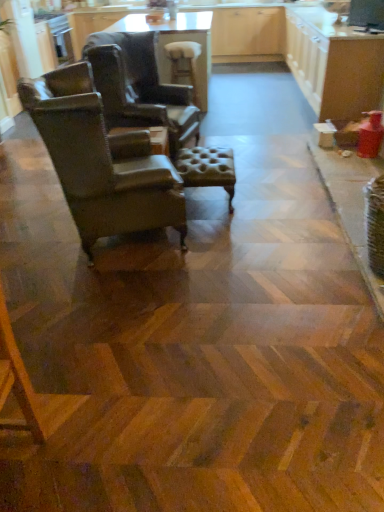
Question: From the image's perspective, is leather wingback chair at left, positioned as the 2th chair in front-to-back order, above white glossy cabinets at upper right?

Choices:
 (A) no
 (B) yes

Answer: (A)

Question: From a real-world perspective, is leather wingback chair at left, positioned as the 2th chair in front-to-back order, beneath white glossy cabinets at upper right?

Choices:
 (A) yes
 (B) no

Answer: (B)

Question: Is leather wingback chair at left, positioned as the 2th chair in front-to-back order, to the right of white glossy cabinets at upper right from the viewer's perspective?

Choices:
 (A) no
 (B) yes

Answer: (A)

Question: Does leather wingback chair at left, positioned as the 2th chair in front-to-back order, appear on the left side of white glossy cabinets at upper right?

Choices:
 (A) no
 (B) yes

Answer: (B)

Question: Is leather wingback chair at left, the 1th chair from the back, positioned in front of white glossy cabinets at upper right?

Choices:
 (A) no
 (B) yes

Answer: (B)

Question: From a real-world perspective, is brown leather chair at left, placed as the second chair when sorted from back to front, positioned above or below tufted leather ottoman at center, the second bar stool viewed from the top?

Choices:
 (A) above
 (B) below

Answer: (A)

Question: Visually, is brown leather chair at left, placed as the second chair when sorted from back to front, positioned to the left or to the right of tufted leather ottoman at center, which ranks as the 2th bar stool in back-to-front order?

Choices:
 (A) right
 (B) left

Answer: (B)

Question: Is brown leather chair at left, the first chair from the front, spatially inside tufted leather ottoman at center, the second bar stool viewed from the top, or outside of it?

Choices:
 (A) inside
 (B) outside

Answer: (B)

Question: Looking at their shapes, would you say brown leather chair at left, the first chair from the front, is wider or thinner than tufted leather ottoman at center, which is the 1th bar stool in front-to-back order?

Choices:
 (A) thin
 (B) wide

Answer: (B)

Question: Is point (347, 60) closer or farther from the camera than point (188, 147)?

Choices:
 (A) farther
 (B) closer

Answer: (A)

Question: Is white glossy cabinets at upper right wider or thinner than tufted leather ottoman at center, which is the 1th bar stool in front-to-back order?

Choices:
 (A) thin
 (B) wide

Answer: (B)

Question: Considering their positions, is white glossy cabinets at upper right located in front of or behind tufted leather ottoman at center, which ranks as the 1th bar stool in bottom-to-top order?

Choices:
 (A) behind
 (B) front

Answer: (A)

Question: In the image, is white glossy cabinets at upper right on the left side or the right side of tufted leather ottoman at center, the second bar stool viewed from the top?

Choices:
 (A) right
 (B) left

Answer: (A)

Question: Considering the positions of tufted leather ottoman at center, which ranks as the 1th bar stool in bottom-to-top order, and wooden glossy table at upper center in the image, is tufted leather ottoman at center, which ranks as the 1th bar stool in bottom-to-top order, wider or thinner than wooden glossy table at upper center?

Choices:
 (A) wide
 (B) thin

Answer: (B)

Question: From the image's perspective, is tufted leather ottoman at center, the second bar stool viewed from the top, located above or below wooden glossy table at upper center?

Choices:
 (A) above
 (B) below

Answer: (B)